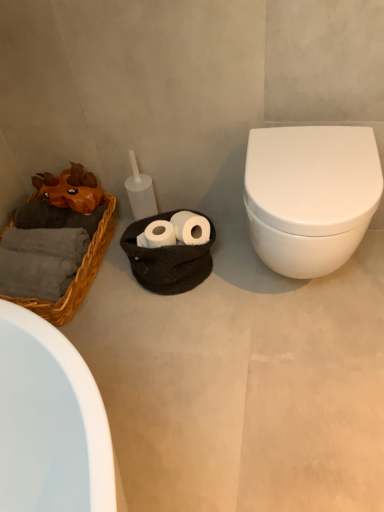
This screenshot has width=384, height=512. Find the location of `free space below white glossy toilet at right (from a real-world perspective)`. free space below white glossy toilet at right (from a real-world perspective) is located at coordinates (310, 292).